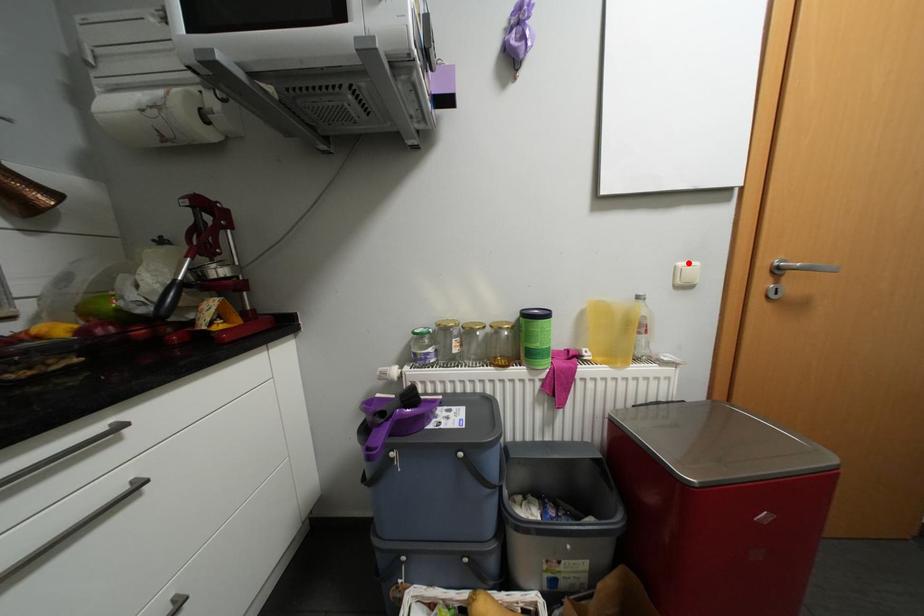
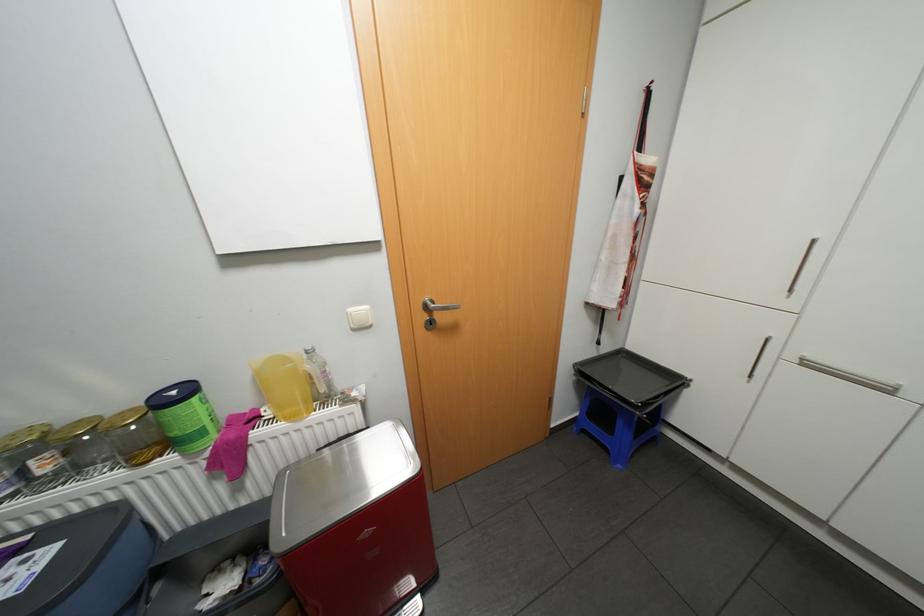
In the second image, find the point that corresponds to the highlighted location in the first image.

(358, 309)